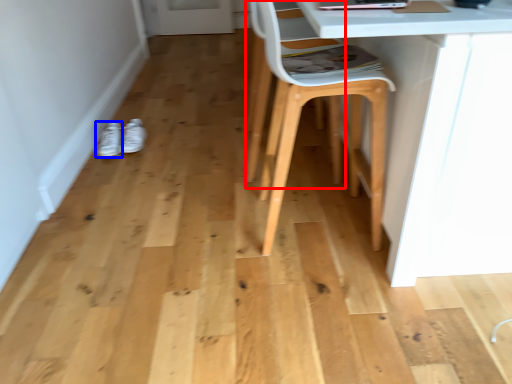
Question: Which point is closer to the camera, swivel chair (highlighted by a red box) or footwear (highlighted by a blue box)?

Choices:
 (A) swivel chair
 (B) footwear

Answer: (A)